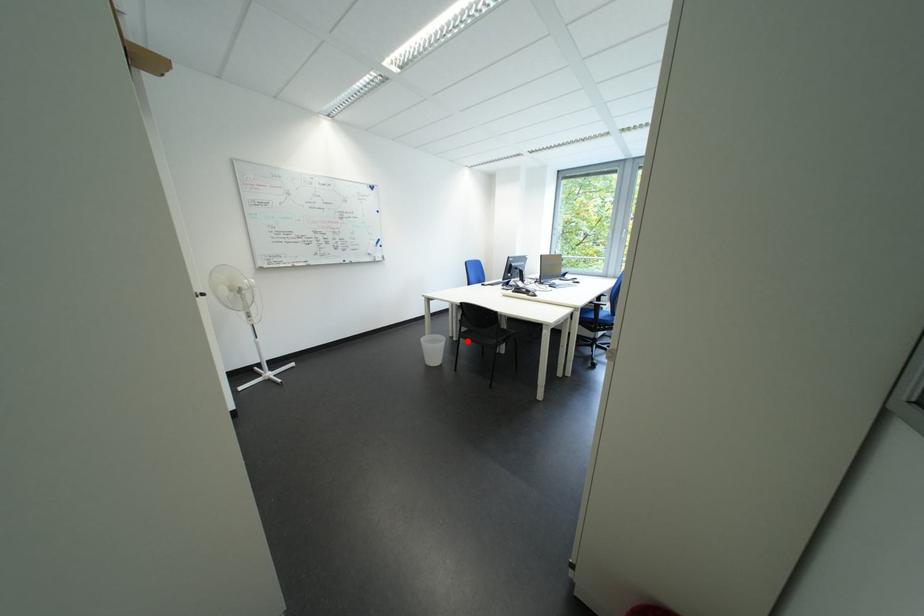
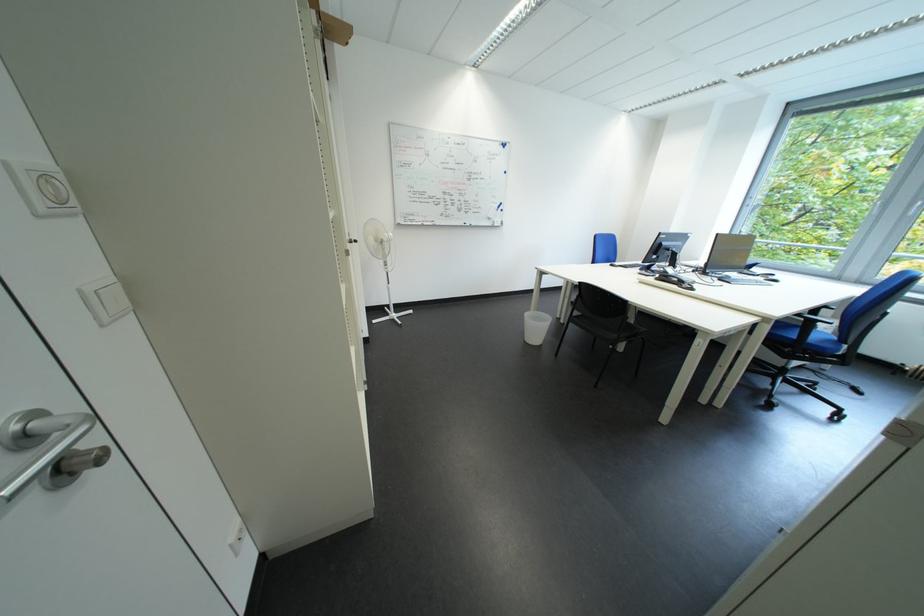
Find the pixel in the second image that matches the highlighted location in the first image.

(575, 323)